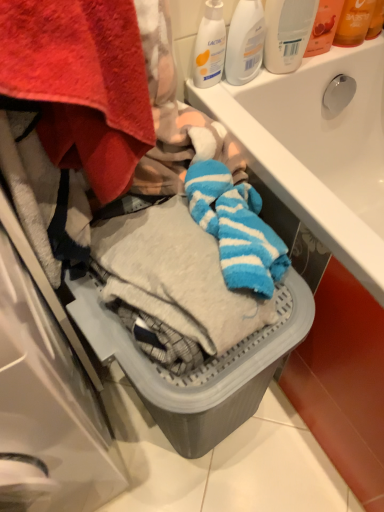
Question: Is white glossy sink at upper center a part of white plastic bottle at upper center, which is the 2th cleaning product in right-to-left order?

Choices:
 (A) yes
 (B) no

Answer: (B)

Question: Can you confirm if white plastic bottle at upper center, the second cleaning product positioned from the left, is shorter than white glossy sink at upper center?

Choices:
 (A) no
 (B) yes

Answer: (B)

Question: Does white plastic bottle at upper center, the second cleaning product positioned from the left, have a greater height compared to white glossy sink at upper center?

Choices:
 (A) no
 (B) yes

Answer: (A)

Question: From the image's perspective, is white plastic bottle at upper center, the second cleaning product positioned from the left, located beneath white glossy sink at upper center?

Choices:
 (A) no
 (B) yes

Answer: (A)

Question: Is white plastic bottle at upper center, which is the 2th cleaning product in right-to-left order, positioned beyond the bounds of white glossy sink at upper center?

Choices:
 (A) no
 (B) yes

Answer: (B)

Question: Are white plastic bottle at upper center, the second cleaning product positioned from the left, and white glossy sink at upper center making contact?

Choices:
 (A) no
 (B) yes

Answer: (A)

Question: Can you confirm if white plastic bottle at upper right, placed as the third cleaning product when sorted from left to right, is positioned to the left of white glossy sink at upper center?

Choices:
 (A) yes
 (B) no

Answer: (A)

Question: Can you confirm if white plastic bottle at upper right, placed as the third cleaning product when sorted from left to right, is smaller than white glossy sink at upper center?

Choices:
 (A) no
 (B) yes

Answer: (B)

Question: Is white plastic bottle at upper right, marked as the 1th cleaning product in a right-to-left arrangement, far away from white glossy sink at upper center?

Choices:
 (A) no
 (B) yes

Answer: (A)

Question: From the image's perspective, does white plastic bottle at upper right, marked as the 1th cleaning product in a right-to-left arrangement, appear higher than white glossy sink at upper center?

Choices:
 (A) yes
 (B) no

Answer: (A)

Question: Is white plastic bottle at upper right, placed as the third cleaning product when sorted from left to right, bigger than white glossy sink at upper center?

Choices:
 (A) no
 (B) yes

Answer: (A)

Question: Is white plastic bottle at upper right, marked as the 1th cleaning product in a right-to-left arrangement, taller than white glossy sink at upper center?

Choices:
 (A) yes
 (B) no

Answer: (B)

Question: From a real-world perspective, does white plastic bottle at upper right, marked as the 1th cleaning product in a right-to-left arrangement, sit lower than translucent plastic bottle at upper right, the 2th toiletry in the right-to-left sequence?

Choices:
 (A) no
 (B) yes

Answer: (A)